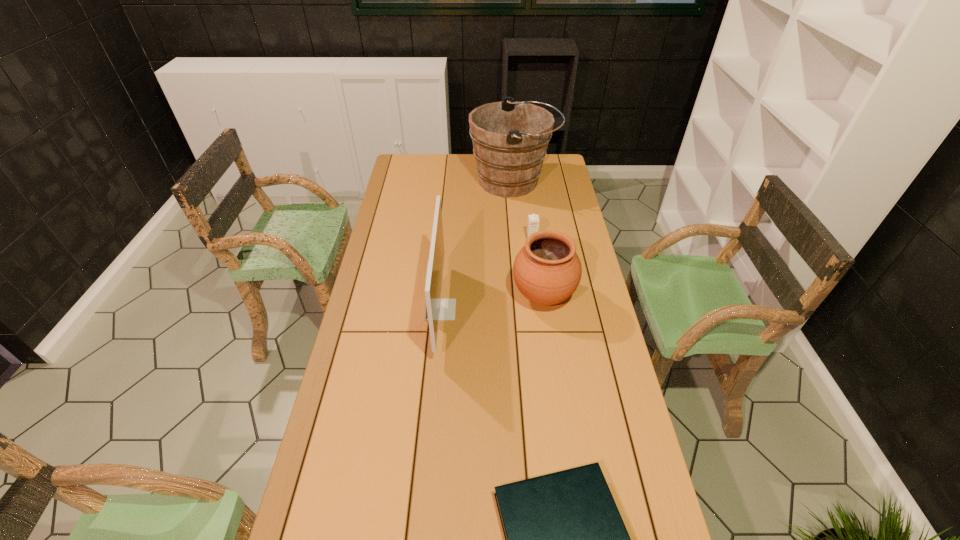
The height and width of the screenshot is (540, 960). What are the coordinates of `bucket` in the screenshot? It's located at (510, 139).

You are a GUI agent. You are given a task and a screenshot of the screen. Output one action in this format:
    pyautogui.click(x=<x>, y=<y>)
    Task: Click on the leftmost object
    This screenshot has width=960, height=540.
    Given the screenshot: What is the action you would take?
    (436, 309)

You are a GUI agent. You are given a task and a screenshot of the screen. Output one action in this format:
    pyautogui.click(x=<x>, y=<y>)
    Task: Click on the third tallest object
    The width and height of the screenshot is (960, 540).
    Given the screenshot: What is the action you would take?
    pyautogui.click(x=547, y=270)

The height and width of the screenshot is (540, 960). I want to click on chocolate milk, so click(x=533, y=220).

Identify the location of the second shortest object. The image size is (960, 540). (533, 220).

Locate an element on the screen. Image resolution: width=960 pixels, height=540 pixels. vacant point located 0.250m on the front-facing side of the leftmost object is located at coordinates (526, 309).

Where is `free space located 0.210m on the left of the third shortest object`? The width and height of the screenshot is (960, 540). free space located 0.210m on the left of the third shortest object is located at coordinates (454, 296).

Identify the location of vacant space located 0.350m on the front of the fourth tallest object. This screenshot has width=960, height=540. (540, 305).

Locate an element on the screen. object at the far edge is located at coordinates (510, 139).

Find the location of `bucket that is at the right edge`. bucket that is at the right edge is located at coordinates (510, 139).